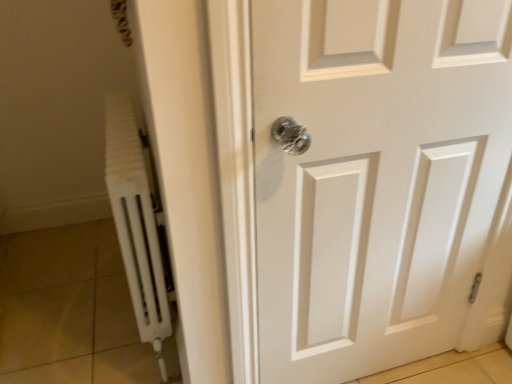
Question: Is white matte door at center in contact with white matte radiator at left?

Choices:
 (A) yes
 (B) no

Answer: (B)

Question: Is white matte door at center wider than white matte radiator at left?

Choices:
 (A) yes
 (B) no

Answer: (B)

Question: Considering the relative positions of white matte door at center and white matte radiator at left in the image provided, is white matte door at center to the left of white matte radiator at left from the viewer's perspective?

Choices:
 (A) yes
 (B) no

Answer: (B)

Question: From a real-world perspective, does white matte door at center sit lower than white matte radiator at left?

Choices:
 (A) yes
 (B) no

Answer: (B)

Question: Is white matte door at center positioned in front of white matte radiator at left?

Choices:
 (A) yes
 (B) no

Answer: (A)

Question: Is white matte door at center to the right of white matte radiator at left from the viewer's perspective?

Choices:
 (A) no
 (B) yes

Answer: (B)

Question: From a real-world perspective, is white matte radiator at left on top of white matte door at center?

Choices:
 (A) no
 (B) yes

Answer: (A)

Question: Is white matte radiator at left closer to the viewer compared to white matte door at center?

Choices:
 (A) no
 (B) yes

Answer: (A)

Question: From the image's perspective, is white matte radiator at left above white matte door at center?

Choices:
 (A) yes
 (B) no

Answer: (A)

Question: Is white matte radiator at left at the left side of white matte door at center?

Choices:
 (A) yes
 (B) no

Answer: (A)

Question: Does white matte radiator at left have a greater width compared to white matte door at center?

Choices:
 (A) no
 (B) yes

Answer: (B)

Question: Is white matte radiator at left not near white matte door at center?

Choices:
 (A) yes
 (B) no

Answer: (B)

Question: Which is correct: white matte door at center is inside white matte radiator at left, or outside of it?

Choices:
 (A) inside
 (B) outside

Answer: (B)